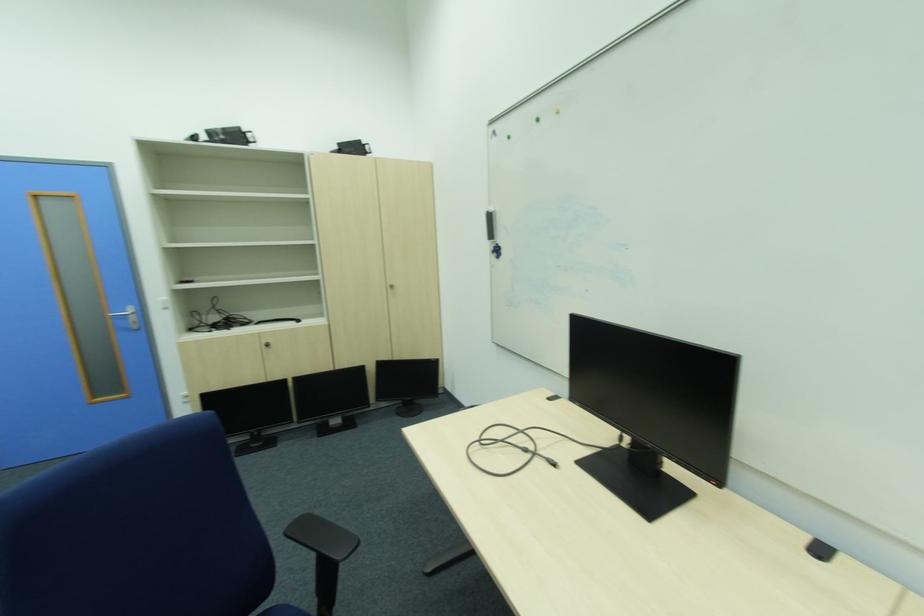
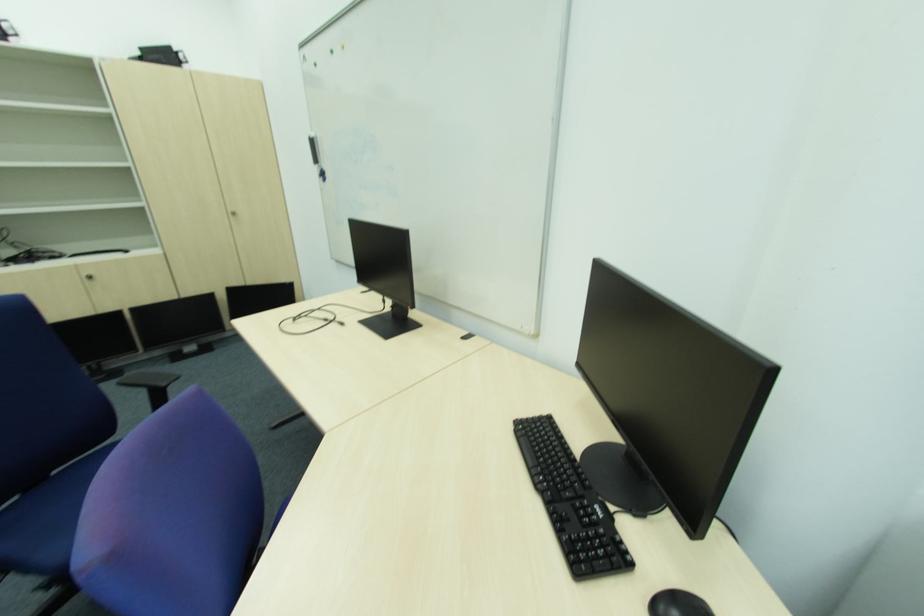
Find the pixel in the second image that matches (271,347) in the first image.

(92, 280)